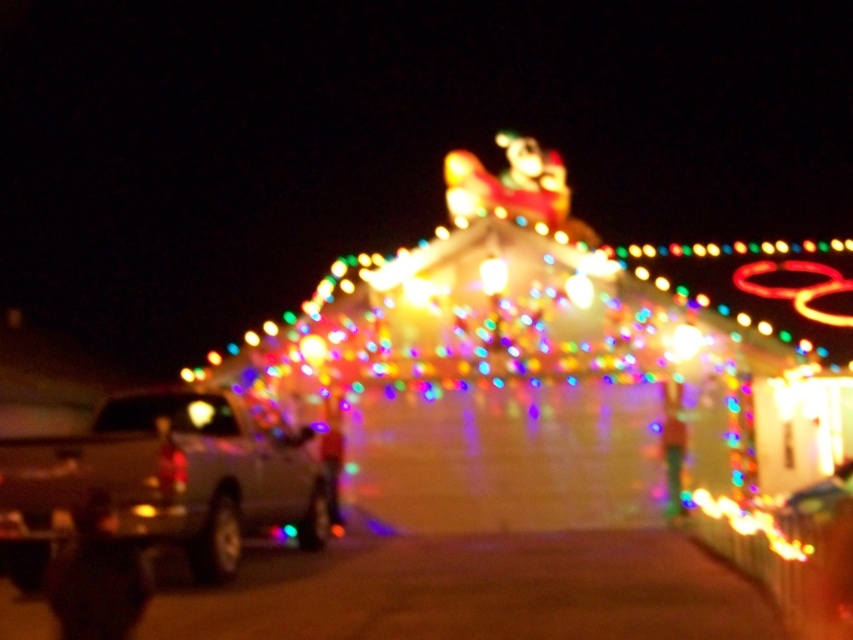
You are a delivery driver who needs to park your vehicle in the driveway next to the house. The driveway has limited space. Given that you have a metallic silver truck at left and a metallic silver car at right, which vehicle would require more space to park?

The metallic silver car at right requires more space to park because it is taller than the metallic silver truck at left.

You are standing in front of the house with the Christmas lights and want to park your metallic silver truck at left. Where should you position it relative to the house?

The metallic silver truck at left should be positioned at the coordinates point (165,480) as specified in the description.

You are a guest arriving at this house for a holiday party. You see the metallic silver truck at left and the metallic silver car at right in the driveway. Which vehicle should you park behind to stay closer to the entrance?

You should park behind the metallic silver car at right because the metallic silver truck at left is closer to you, so parking behind the car would place you nearer to the house entrance.